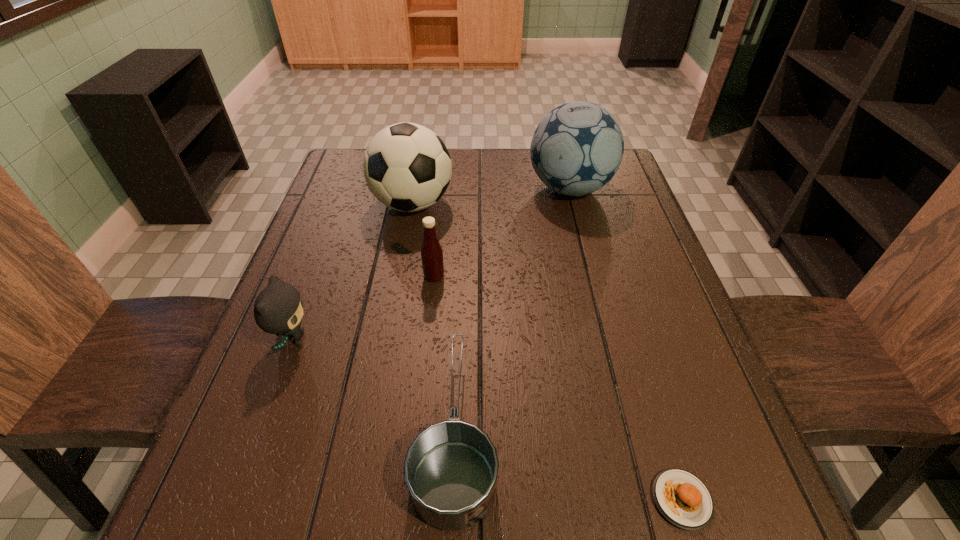
Image resolution: width=960 pixels, height=540 pixels. Identify the location of free point located 0.190m on the front of the Tabasco sauce. (426, 353).

What are the coordinates of `free space located on the front-facing side of the leftmost object` in the screenshot? It's located at (446, 340).

I want to click on vacant region located with the handle extending from one side of the saucepan, so click(460, 329).

Where is `free space located 0.400m with the handle extending from one side of the saucepan`? free space located 0.400m with the handle extending from one side of the saucepan is located at coordinates (464, 227).

This screenshot has height=540, width=960. I want to click on vacant region located with the handle extending from one side of the saucepan, so click(463, 252).

Locate an element on the screen. This screenshot has width=960, height=540. vacant space situated on the left of the food is located at coordinates (555, 500).

This screenshot has width=960, height=540. What are the coordinates of `saucepan that is at the near edge` in the screenshot? It's located at (451, 467).

Identify the location of food situated at the near edge. pyautogui.click(x=682, y=498).

I want to click on soccer ball located in the left edge section of the desktop, so click(x=407, y=167).

The image size is (960, 540). What are the coordinates of `kitten located at the left edge` in the screenshot? It's located at (278, 309).